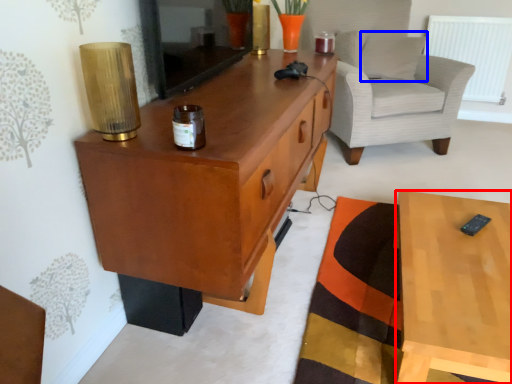
Question: Which of the following is the farthest to the observer, desk (highlighted by a red box) or pillow (highlighted by a blue box)?

Choices:
 (A) desk
 (B) pillow

Answer: (B)